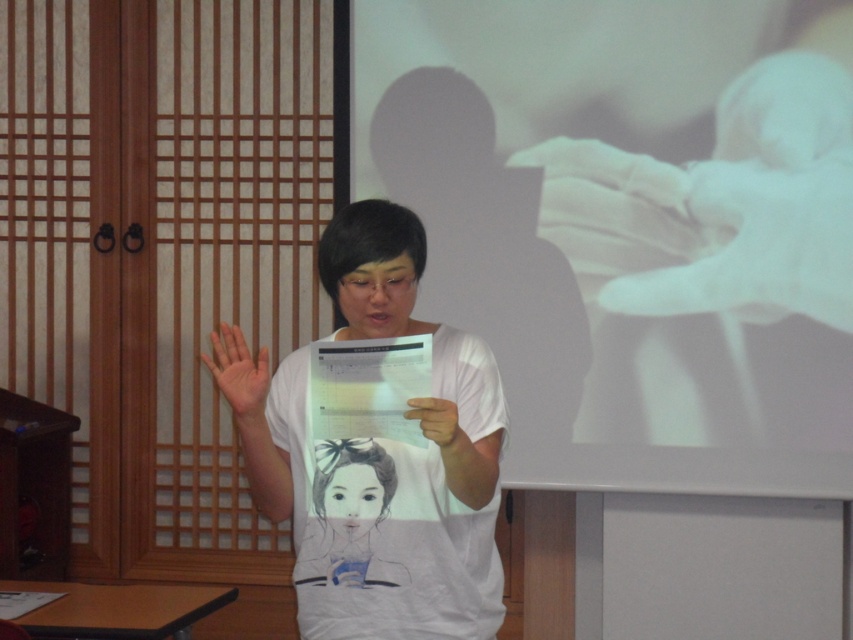
Can you confirm if matte white hand at center is positioned to the right of white matte paper at center?

Incorrect, matte white hand at center is not on the right side of white matte paper at center.

Can you confirm if matte white hand at center is shorter than white matte paper at center?

Incorrect, matte white hand at center's height does not fall short of white matte paper at center's.

Find the location of a particular element. The height and width of the screenshot is (640, 853). matte white hand at center is located at coordinates (239, 376).

Measure the distance from white matte t-shirt at center to white matte paper at center.

white matte t-shirt at center and white matte paper at center are 22.15 centimeters apart from each other.

Is point (451, 573) behind point (445, 433)?

Yes.

What do you see at coordinates (384, 456) in the screenshot?
I see `white matte t-shirt at center` at bounding box center [384, 456].

Where is `white matte t-shirt at center`? The image size is (853, 640). white matte t-shirt at center is located at coordinates tap(384, 456).

Which is more to the left, white matte t-shirt at center or white matte projection screen at upper center?

white matte t-shirt at center is more to the left.

Which is in front, point (401, 420) or point (526, 314)?

Positioned in front is point (401, 420).

Which is behind, point (257, 435) or point (390, 19)?

The point (390, 19) is behind.

Locate an element on the screen. Image resolution: width=853 pixels, height=640 pixels. white matte t-shirt at center is located at coordinates (384, 456).